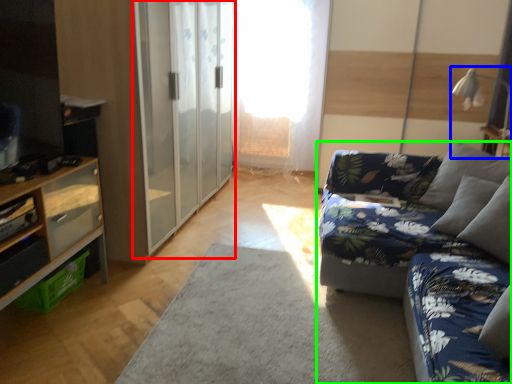
Question: Estimate the real-world distances between objects in this image. Which object is closer to barn door (highlighted by a red box), lamp (highlighted by a blue box) or studio couch (highlighted by a green box)?

Choices:
 (A) lamp
 (B) studio couch

Answer: (B)